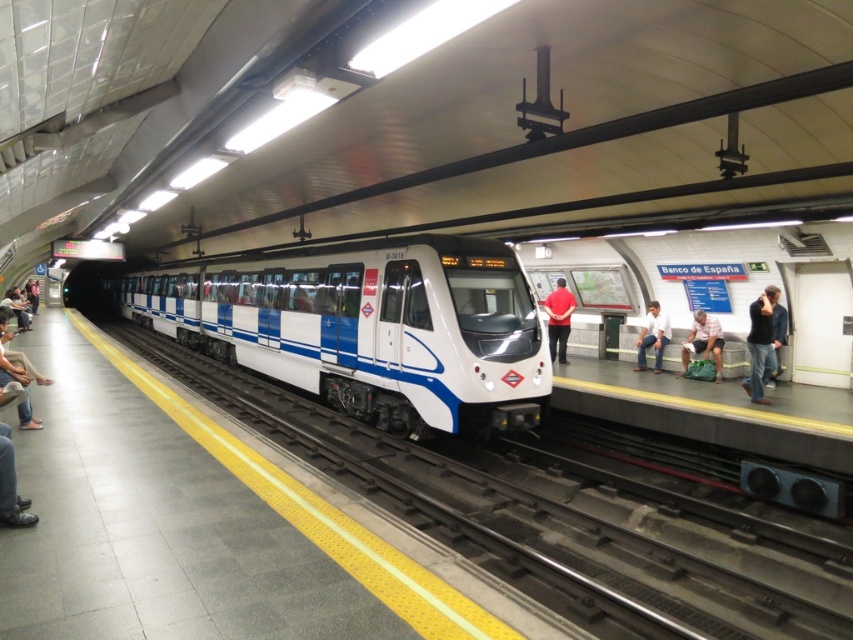
You are standing on the subway platform and want to determine the relative positions of two points marked on the train. Which point, point (718,332) or point (550,292), is closer to you?

Point (718,332) is closer to the viewer than point (550,292).

You are a passenger waiting at the subway station platform. You notice a green fabric bag at right and a red cotton shirt at center. Which object is positioned lower from the ground?

The green fabric bag at right is below the red cotton shirt at center, so the green fabric bag at right is positioned lower from the ground.

You are a passenger waiting on the subway platform. You notice the white metal train track at center and the denim pants at lower left. Which object is closer to the edge of the platform?

The denim pants at lower left are closer to the edge of the platform because the white metal train track at center is located below them, indicating the denim pants are positioned higher up on the platform near the edge.